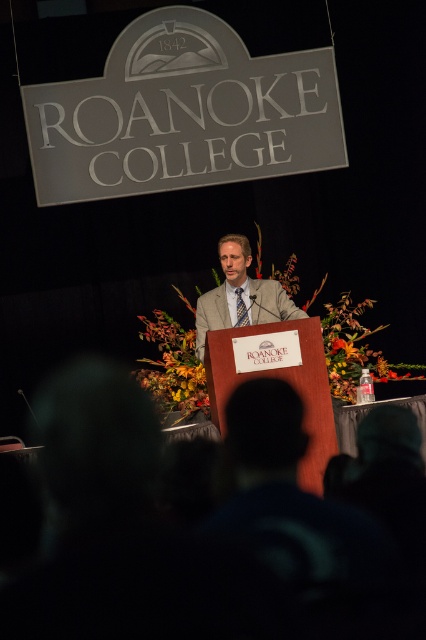
You are standing at the back of the event hall and want to hand a note to the speaker wearing the light brown suit at center. If your throwing range is up to 5 meters, can you reach them?

The light brown suit at center is 5.04 meters away from the viewer. Since your throwing range is up to 5 meters, you cannot reach them as the distance exceeds your range by 0.04 meters.

Looking at this image, you are attending the Roanoke College event and want to locate the speaker. According to the coordinates given, where exactly is the light brown suit at center located?

The light brown suit at center is located at coordinates point (241, 294).

You are an attendee at the Roanoke College event and notice the speaker wearing a light brown suit at center and a blue checkered tie at center. Where is the blue checkered tie located in relation to the light brown suit?

The blue checkered tie at center is below the light brown suit at center since the light brown suit at center is above the blue checkered tie at center.